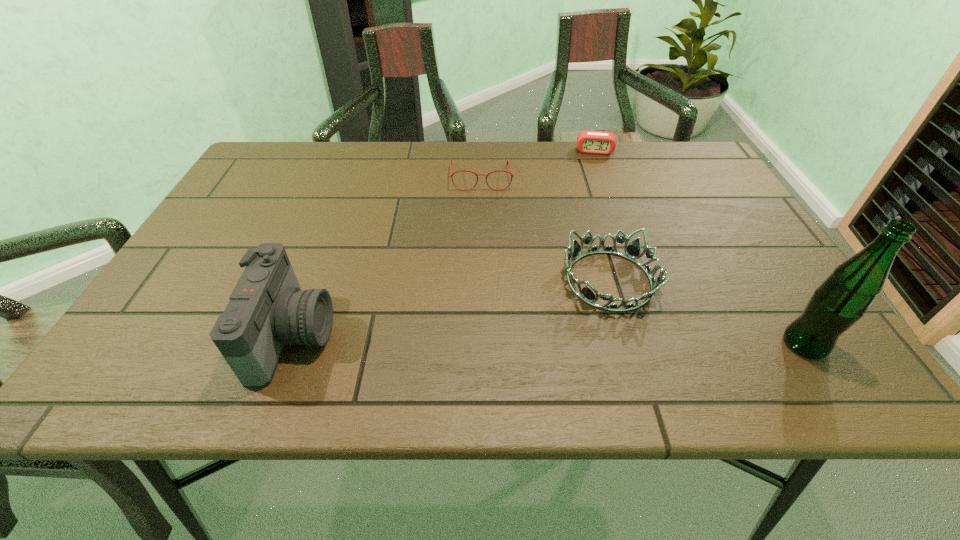
What are the coordinates of `vacant region located on the front-facing side of the farthest object` in the screenshot? It's located at (596, 203).

This screenshot has height=540, width=960. I want to click on vacant space located on the front-facing side of the farthest object, so click(x=597, y=220).

Image resolution: width=960 pixels, height=540 pixels. I want to click on vacant space situated 0.320m on the front-facing side of the farthest object, so click(598, 222).

Where is `free space located on the front-facing side of the third tallest object`? The image size is (960, 540). free space located on the front-facing side of the third tallest object is located at coordinates (557, 332).

Find the location of a particular element. Image resolution: width=960 pixels, height=540 pixels. free location located on the face of the fourth nearest object is located at coordinates (484, 254).

The width and height of the screenshot is (960, 540). Find the location of `blank space located 0.310m on the face of the fourth nearest object`. blank space located 0.310m on the face of the fourth nearest object is located at coordinates (484, 273).

Find the location of a particular element. free point located on the face of the fourth nearest object is located at coordinates (482, 219).

Find the location of a particular element. alarm clock located at the far edge is located at coordinates (591, 142).

Identify the location of spectacles located at the far edge. The height and width of the screenshot is (540, 960). (451, 174).

The height and width of the screenshot is (540, 960). In order to click on camera at the near edge in this screenshot , I will do `click(267, 310)`.